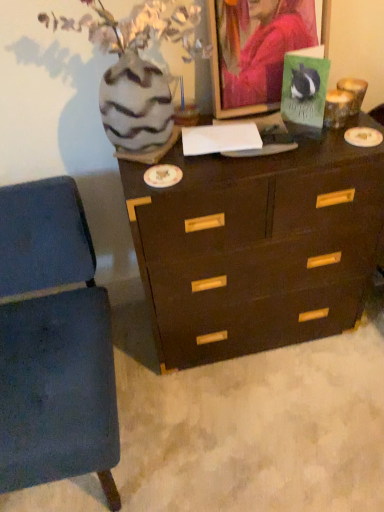
The width and height of the screenshot is (384, 512). Identify the location of vacant area that is in front of dark wood chest of drawers at center. (265, 419).